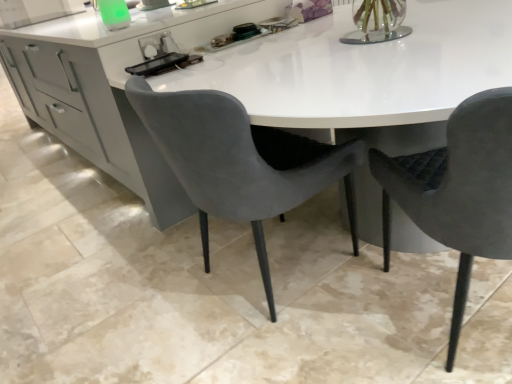
You are a GUI agent. You are given a task and a screenshot of the screen. Output one action in this format:
    pyautogui.click(x=<x>, y=<y>)
    Task: Click on the free region under velvet grey chair at center, arranged as the 2th chair when viewed from the right (from a real-world perspective)
    The width and height of the screenshot is (512, 384).
    Given the screenshot: What is the action you would take?
    pyautogui.click(x=269, y=271)